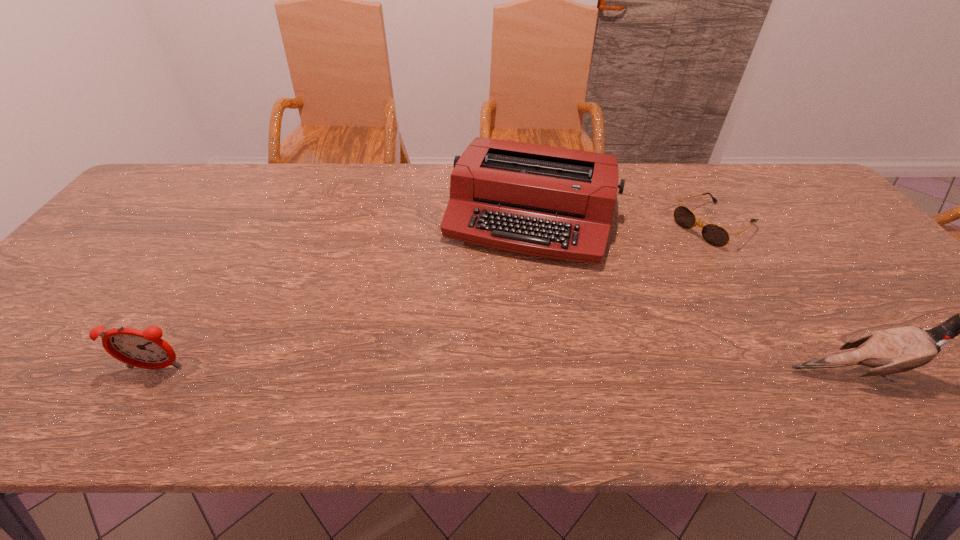
I want to click on vacant region at the right edge of the desktop, so click(x=842, y=257).

The height and width of the screenshot is (540, 960). What are the coordinates of `free space at the far right corner of the desktop` in the screenshot? It's located at (782, 194).

Where is `vacant area that lies between the sunglasses and the tallest object`? The image size is (960, 540). vacant area that lies between the sunglasses and the tallest object is located at coordinates (784, 299).

The width and height of the screenshot is (960, 540). Identify the location of unoccupied position between the leftmost object and the tallest object. (505, 370).

You are a GUI agent. You are given a task and a screenshot of the screen. Output one action in this format:
    pyautogui.click(x=<x>, y=<y>)
    Task: Click on the vacant area between the tallest object and the sunglasses
    This screenshot has height=540, width=960.
    Given the screenshot: What is the action you would take?
    pyautogui.click(x=784, y=299)

Locate an element on the screen. The image size is (960, 540). vacant area that lies between the shortest object and the bird is located at coordinates (784, 299).

Image resolution: width=960 pixels, height=540 pixels. In order to click on free space that is in between the tallest object and the typewriter in this screenshot , I will do `click(692, 294)`.

The height and width of the screenshot is (540, 960). What are the coordinates of `vacant region between the shortest object and the bird` in the screenshot? It's located at (784, 299).

Where is `empty space between the shortest object and the bird`? The image size is (960, 540). empty space between the shortest object and the bird is located at coordinates (784, 299).

I want to click on vacant region between the sunglasses and the leftmost object, so click(x=435, y=297).